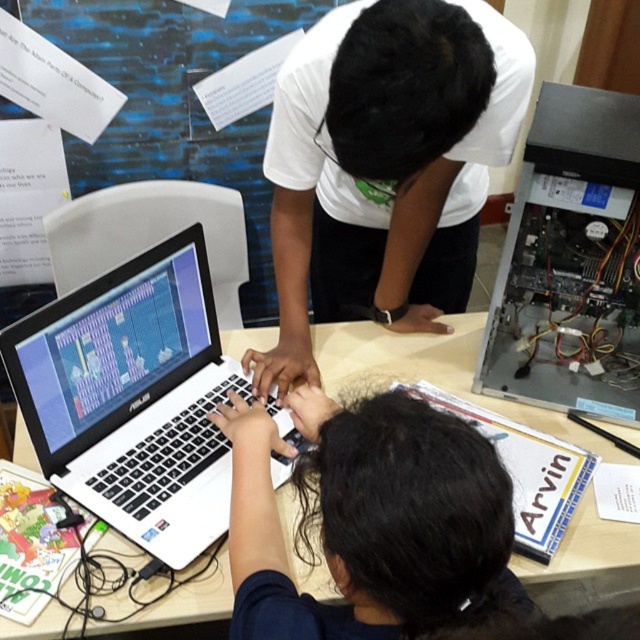
Who is taller, black matte laptop at center or white matte table at center?

black matte laptop at center is taller.

Between point (147, 444) and point (413, 380), which one is positioned in front?

Point (147, 444) is more forward.

Is point (76, 337) less distant than point (173, 612)?

No, (76, 337) is further to viewer.

Locate an element on the screen. black matte laptop at center is located at coordinates (132, 397).

Does black matte laptop at center have a lesser width compared to silver metallic computer case at right?

No, black matte laptop at center is not thinner than silver metallic computer case at right.

Is black matte laptop at center positioned in front of silver metallic computer case at right?

Yes, black matte laptop at center is closer to the viewer.

Does point (125, 513) come closer to viewer compared to point (637, 369)?

That is True.

Image resolution: width=640 pixels, height=640 pixels. What are the coordinates of `black matte laptop at center` in the screenshot? It's located at (132, 397).

What do you see at coordinates (173, 100) in the screenshot? The height and width of the screenshot is (640, 640). I see `blue paper at upper left` at bounding box center [173, 100].

Does blue paper at upper left have a smaller size compared to white matte table at center?

Incorrect, blue paper at upper left is not smaller in size than white matte table at center.

Locate an element on the screen. blue paper at upper left is located at coordinates (173, 100).